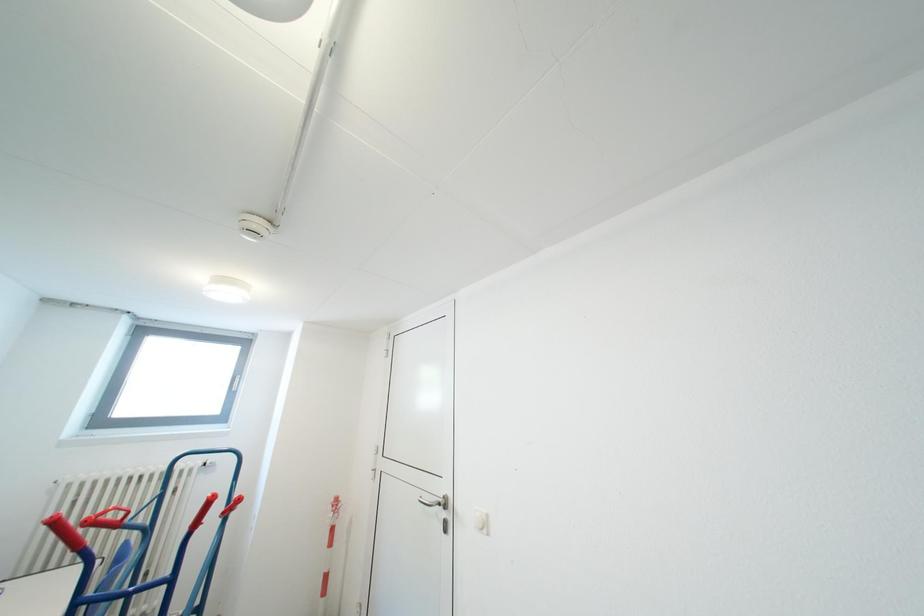
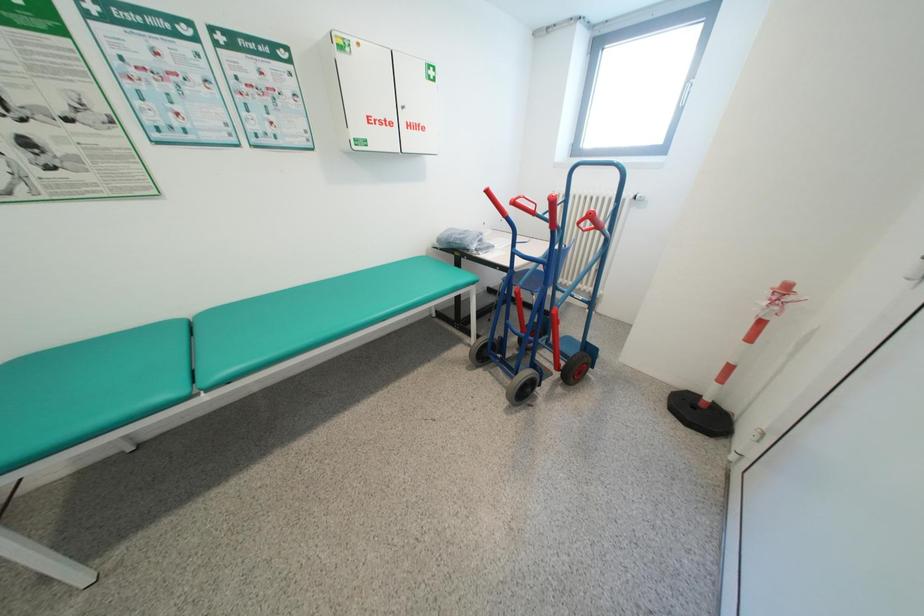
First-person continuous shooting, in which direction is the camera rotating?

The rotation direction of the camera is left-down.